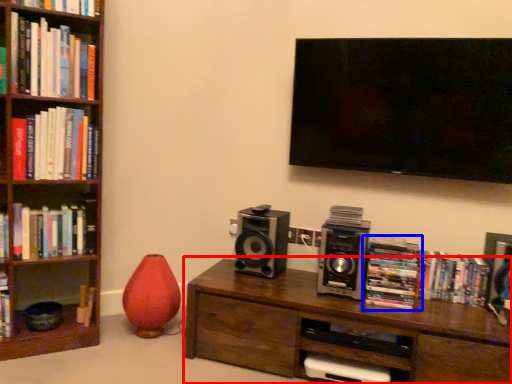
Question: Which point is further to the camera, table (highlighted by a red box) or book (highlighted by a blue box)?

Choices:
 (A) table
 (B) book

Answer: (B)